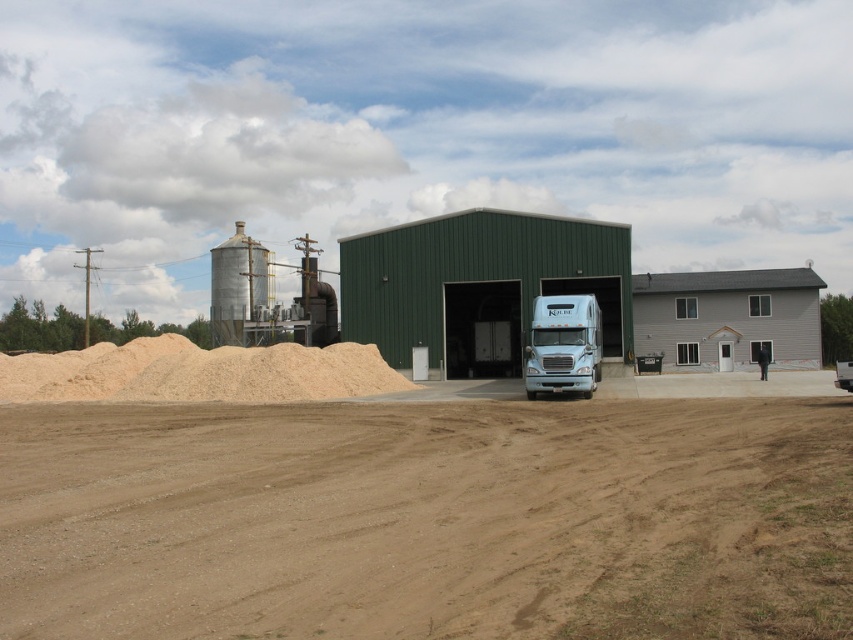
Does green metal/glass barn at center appear under light blue metallic trailer truck at center?

Incorrect, green metal/glass barn at center is not positioned below light blue metallic trailer truck at center.

Is green metal/glass barn at center taller than light blue metallic trailer truck at center?

Indeed, green metal/glass barn at center has a greater height compared to light blue metallic trailer truck at center.

Locate an element on the screen. Image resolution: width=853 pixels, height=640 pixels. green metal/glass barn at center is located at coordinates (479, 284).

Does point (659, 282) lie behind point (593, 330)?

Yes, it is.

This screenshot has width=853, height=640. What do you see at coordinates (728, 317) in the screenshot?
I see `gray matte house at right` at bounding box center [728, 317].

At what (x,y) coordinates should I click in order to perform the action: click on gray matte house at right. Please return your answer as a coordinate pair (x, y). This screenshot has height=640, width=853. Looking at the image, I should click on (728, 317).

Which of these two, green metal/glass barn at center or gray matte house at right, stands taller?

With more height is green metal/glass barn at center.

Who is more forward, (549, 292) or (810, 317)?

Point (549, 292)

Where is `green metal/glass barn at center`? green metal/glass barn at center is located at coordinates (479, 284).